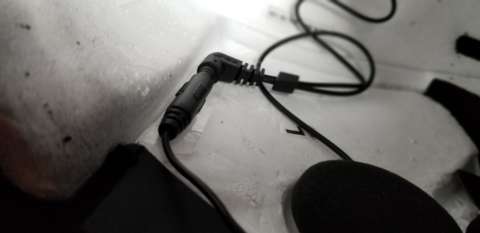
Find the location of a particular element. The width and height of the screenshot is (480, 233). gray corner is located at coordinates (219, 26).